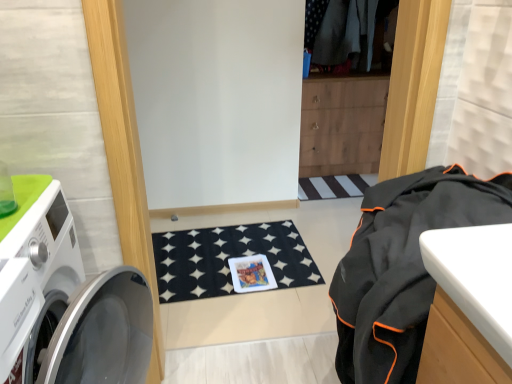
Question: Is black mesh bag at right bigger than white glossy washing machine at left?

Choices:
 (A) yes
 (B) no

Answer: (B)

Question: Is black mesh bag at right smaller than white glossy washing machine at left?

Choices:
 (A) yes
 (B) no

Answer: (A)

Question: Considering the relative sizes of black mesh bag at right and white glossy washing machine at left in the image provided, is black mesh bag at right thinner than white glossy washing machine at left?

Choices:
 (A) no
 (B) yes

Answer: (B)

Question: Is the surface of black mesh bag at right in direct contact with white glossy washing machine at left?

Choices:
 (A) yes
 (B) no

Answer: (B)

Question: Does black mesh bag at right appear on the right side of white glossy washing machine at left?

Choices:
 (A) no
 (B) yes

Answer: (B)

Question: Is black mesh bag at right to the left of white glossy washing machine at left from the viewer's perspective?

Choices:
 (A) no
 (B) yes

Answer: (A)

Question: From a real-world perspective, is white glossy washing machine at left located higher than black mesh bag at right?

Choices:
 (A) no
 (B) yes

Answer: (A)

Question: Is black mesh bag at right at the back of white glossy washing machine at left?

Choices:
 (A) no
 (B) yes

Answer: (A)

Question: From the image's perspective, does white glossy washing machine at left appear lower than black mesh bag at right?

Choices:
 (A) no
 (B) yes

Answer: (B)

Question: Considering the relative positions of white glossy washing machine at left and black mesh bag at right in the image provided, is white glossy washing machine at left in front of black mesh bag at right?

Choices:
 (A) yes
 (B) no

Answer: (A)

Question: Are white glossy washing machine at left and black mesh bag at right beside each other?

Choices:
 (A) no
 (B) yes

Answer: (A)

Question: From a real-world perspective, does white glossy washing machine at left sit lower than black mesh bag at right?

Choices:
 (A) no
 (B) yes

Answer: (B)

Question: From a real-world perspective, is black mesh bag at right physically located above or below white glossy washing machine at left?

Choices:
 (A) above
 (B) below

Answer: (A)